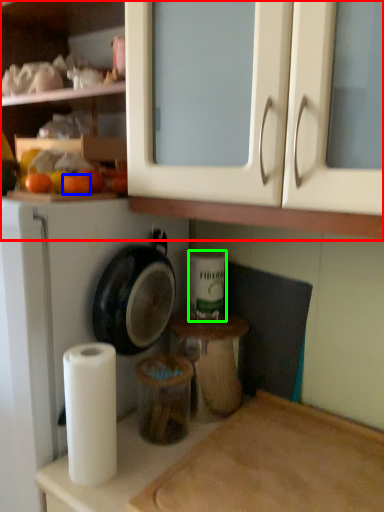
Question: Which object is the farthest from cabinetry (highlighted by a red box)? Choose among these: orange (highlighted by a blue box) or toilet paper (highlighted by a green box).

Choices:
 (A) orange
 (B) toilet paper

Answer: (B)